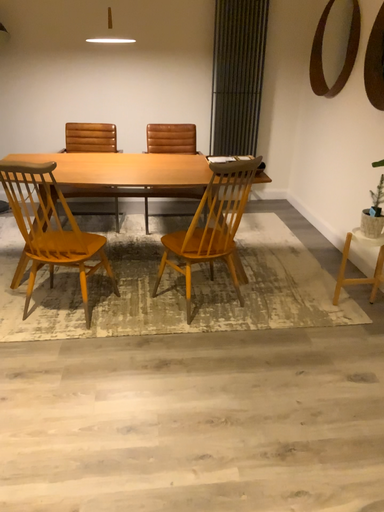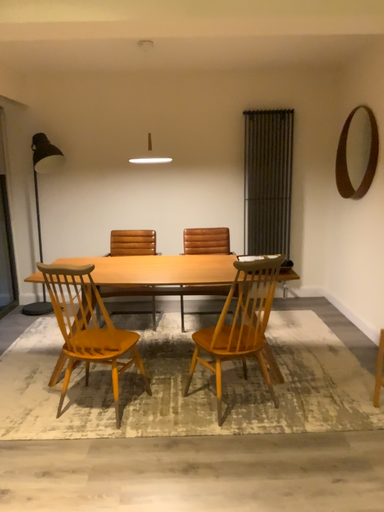
Question: Which way did the camera rotate in the video?

Choices:
 (A) rotated downward
 (B) rotated upward

Answer: (B)